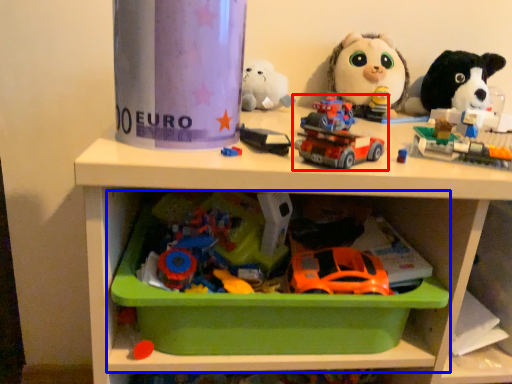
Question: Which point is further to the camera, toy (highlighted by a red box) or shelf (highlighted by a blue box)?

Choices:
 (A) toy
 (B) shelf

Answer: (B)